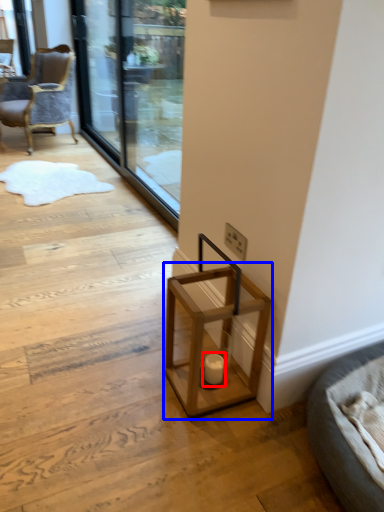
Question: Among these objects, which one is farthest to the camera, candle holder (highlighted by a red box) or table (highlighted by a blue box)?

Choices:
 (A) candle holder
 (B) table

Answer: (A)